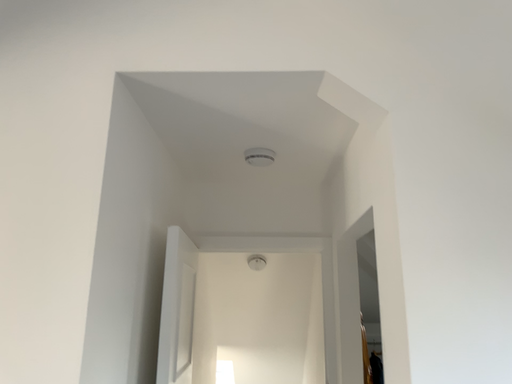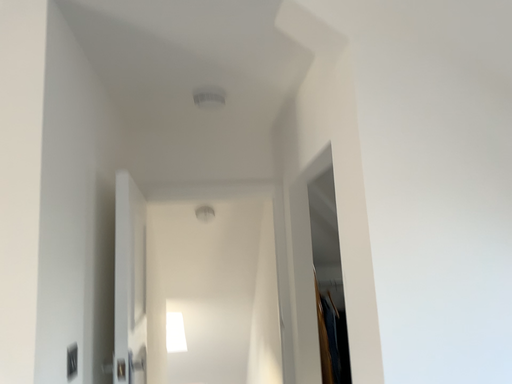
Question: How did the camera likely rotate when shooting the video?

Choices:
 (A) rotated left
 (B) rotated right

Answer: (B)